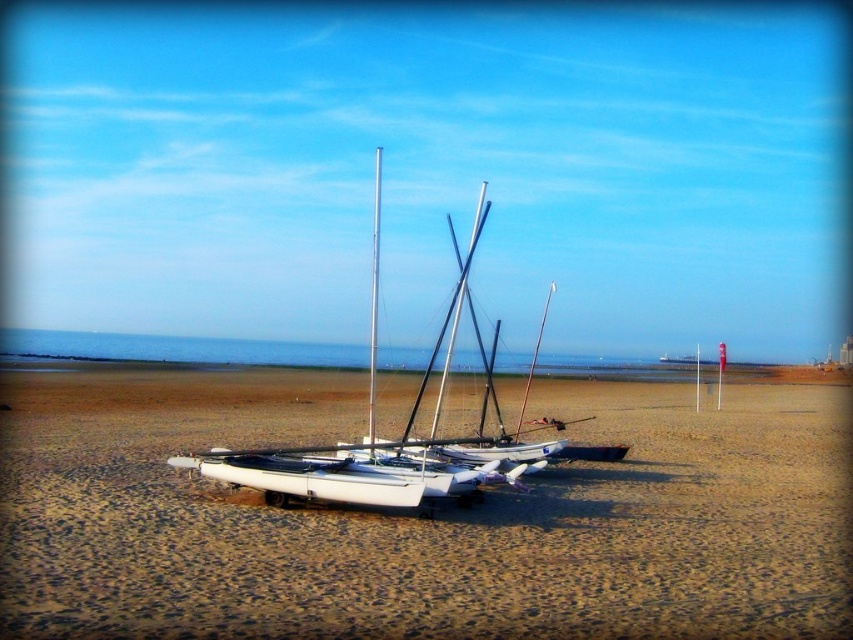
You are standing on the beach and want to place a small flag exactly where the white sand at center and the silver metallic mast at center meet. Where should you place the flag?

The white sand at center is below the silver metallic mast at center, so you should place the flag at the base of the silver metallic mast at center where it meets the white sand at center.

Based on the photo, you are standing on the beach and want to place a 1.5 meter wide picnic blanket between the white sand at center and the silver metallic mast at center. Can you fit the picnic blanket between them without overlapping either object?

The white sand at center might be wider than the silver metallic mast at center, so there might be enough space to place the 1.5 meter wide picnic blanket between them without overlapping either object.